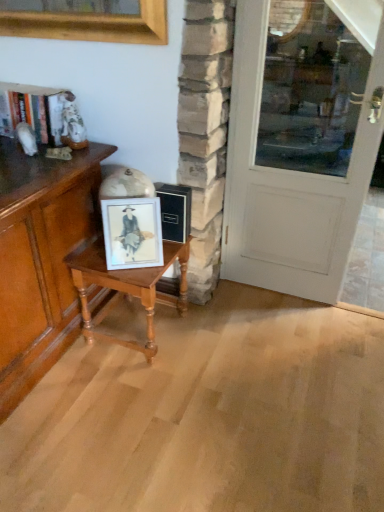
The width and height of the screenshot is (384, 512). I want to click on free region under wooden table at center (from a real-world perspective), so coord(141,337).